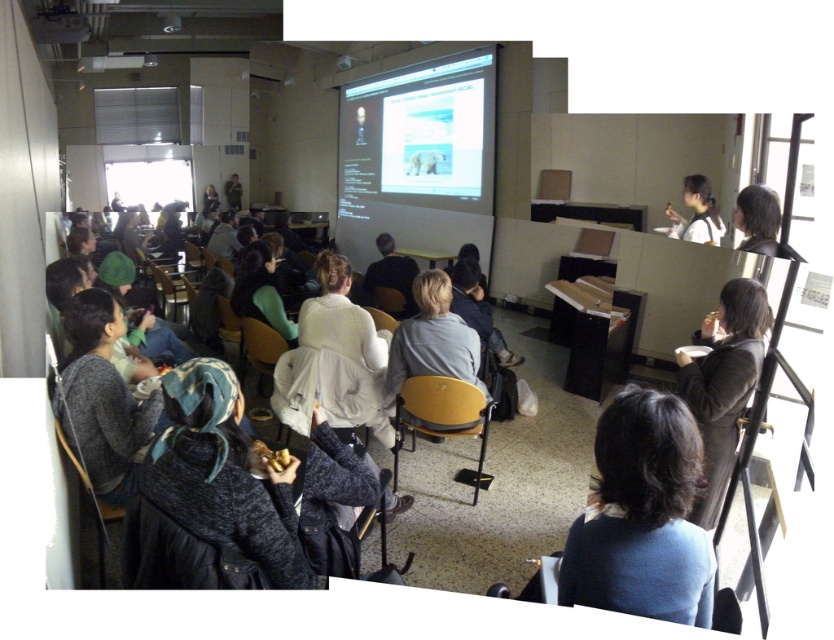
Question: Is dark brown leather jacket at right smaller than white matte jacket at upper right?

Choices:
 (A) yes
 (B) no

Answer: (B)

Question: Which object is positioned farthest from the dark brown hair at upper right?

Choices:
 (A) dark brown leather jacket at right
 (B) blue matte sweater at center
 (C) white matte projection screen at center

Answer: (C)

Question: Which object is positioned closest to the dark brown leather jacket at right?

Choices:
 (A) white matte projection screen at center
 (B) white matte jacket at upper right

Answer: (B)

Question: From the image, what is the correct spatial relationship of dark brown leather jacket at right in relation to white matte jacket at upper right?

Choices:
 (A) left
 (B) right

Answer: (A)

Question: Estimate the real-world distances between objects in this image. Which object is farther from the dark brown leather jacket at right?

Choices:
 (A) blue matte sweater at center
 (B) white matte projection screen at center

Answer: (B)

Question: Does blue matte sweater at center have a larger size compared to white matte jacket at upper right?

Choices:
 (A) yes
 (B) no

Answer: (A)